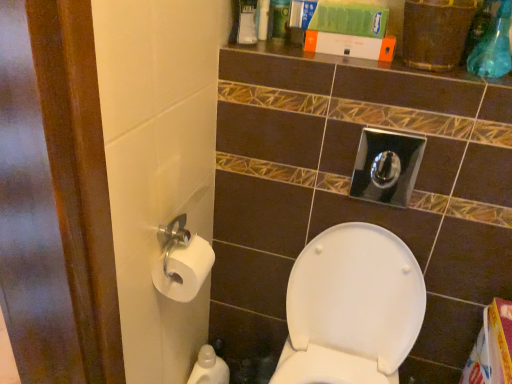
Question: Considering the positions of white paper at left, the first toiletry positioned from the left, and white glossy toilet seat at center in the image, is white paper at left, the first toiletry positioned from the left, wider or thinner than white glossy toilet seat at center?

Choices:
 (A) thin
 (B) wide

Answer: (A)

Question: Is point (190, 261) closer or farther from the camera than point (358, 246)?

Choices:
 (A) closer
 (B) farther

Answer: (A)

Question: Which object is the farthest from the white plastic container at upper center, which ranks as the 2th toiletry in front-to-back order?

Choices:
 (A) white paper at left, positioned as the second toiletry in right-to-left order
 (B) white glossy plastic bottle at lower left
 (C) white glossy toilet seat at center

Answer: (B)

Question: Which is nearer to the white glossy toilet seat at center?

Choices:
 (A) white paper at left, positioned as the second toiletry in right-to-left order
 (B) white plastic container at upper center, the second toiletry positioned from the bottom
 (C) white glossy plastic bottle at lower left

Answer: (C)